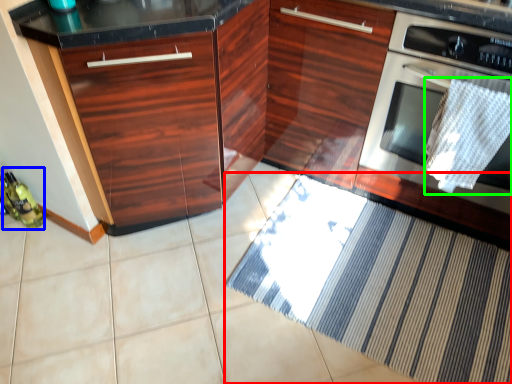
Question: Considering the real-world distances, which object is closest to doormat (highlighted by a red box)? bottle (highlighted by a blue box) or blanket (highlighted by a green box).

Choices:
 (A) bottle
 (B) blanket

Answer: (B)